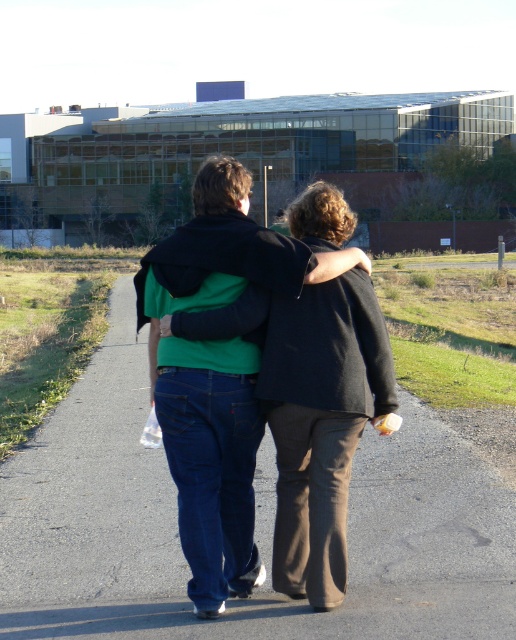
Can you confirm if smooth asphalt road at center is taller than green cotton hoodie at center?

In fact, smooth asphalt road at center may be shorter than green cotton hoodie at center.

Locate an element on the screen. smooth asphalt road at center is located at coordinates (255, 528).

What do you see at coordinates (255, 528) in the screenshot?
I see `smooth asphalt road at center` at bounding box center [255, 528].

Identify the location of smooth asphalt road at center. This screenshot has height=640, width=516. (255, 528).